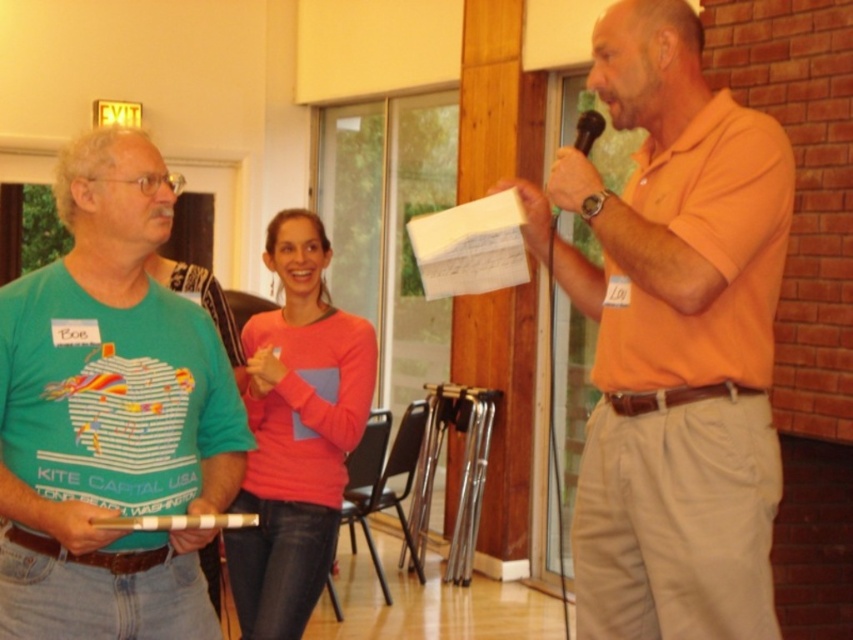
Can you confirm if pink matte sweater at center is taller than black plastic microphone at upper right?

Indeed, pink matte sweater at center has a greater height compared to black plastic microphone at upper right.

Is pink matte sweater at center closer to camera compared to black plastic microphone at upper right?

No, it is behind black plastic microphone at upper right.

Is point (315, 579) in front of point (595, 122)?

No, (315, 579) is behind (595, 122).

You are a GUI agent. You are given a task and a screenshot of the screen. Output one action in this format:
    pyautogui.click(x=<x>, y=<y>)
    Task: Click on the pink matte sweater at center
    This screenshot has height=640, width=853.
    Given the screenshot: What is the action you would take?
    pyautogui.click(x=296, y=433)

Does orange cotton shirt at center have a greater height compared to green matte t-shirt at left?

Yes, orange cotton shirt at center is taller than green matte t-shirt at left.

Can you confirm if orange cotton shirt at center is shorter than green matte t-shirt at left?

Incorrect, orange cotton shirt at center's height does not fall short of green matte t-shirt at left's.

The width and height of the screenshot is (853, 640). What do you see at coordinates (674, 340) in the screenshot?
I see `orange cotton shirt at center` at bounding box center [674, 340].

Locate an element on the screen. The width and height of the screenshot is (853, 640). orange cotton shirt at center is located at coordinates (674, 340).

Does orange cotton shirt at center have a greater height compared to pink matte sweater at center?

Correct, orange cotton shirt at center is much taller as pink matte sweater at center.

The image size is (853, 640). Describe the element at coordinates (674, 340) in the screenshot. I see `orange cotton shirt at center` at that location.

What do you see at coordinates (674, 340) in the screenshot? I see `orange cotton shirt at center` at bounding box center [674, 340].

Identify the location of orange cotton shirt at center. This screenshot has height=640, width=853. (674, 340).